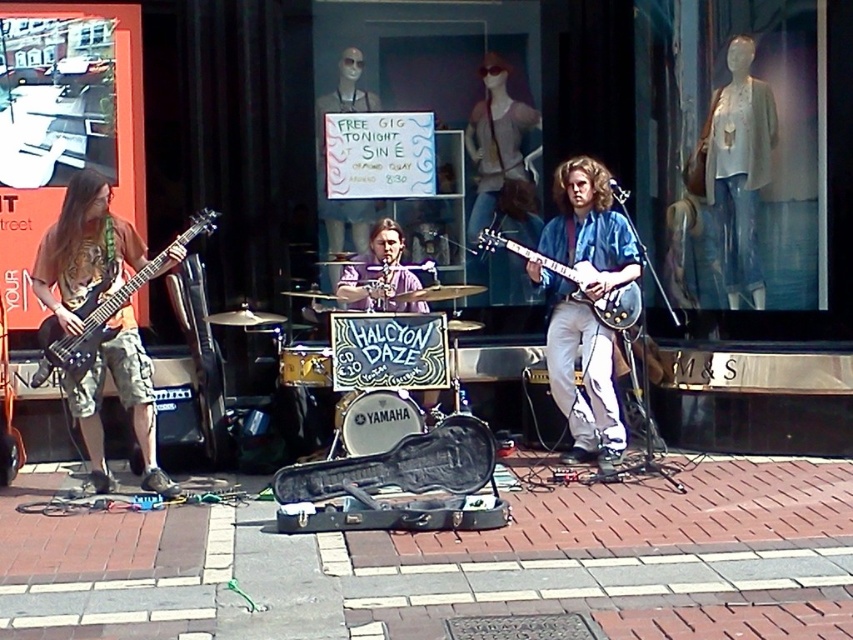
You are a street performer who just finished setting up your equipment. You need to move your matte black guitar at left to the brick pavement at center. Can you move it directly without moving any other objects in the way?

The brick pavement at center is to the right of matte black guitar at left, so there is a clear path to move the matte black guitar at left directly to the brick pavement at center without needing to move other objects.

You are a street performer setting up for a show. You have a matte black guitar at left and a blue glossy guitar at center. Which guitar is wider?

The matte black guitar at left is wider than the blue glossy guitar at center.

You are a photographer standing at the center of the performance area. You want to take a photo of the matte black guitar at left. Where should you position yourself to capture the guitar in the frame?

The matte black guitar at left is located at point (83, 250), so you should position yourself facing that coordinate to capture it in the frame.